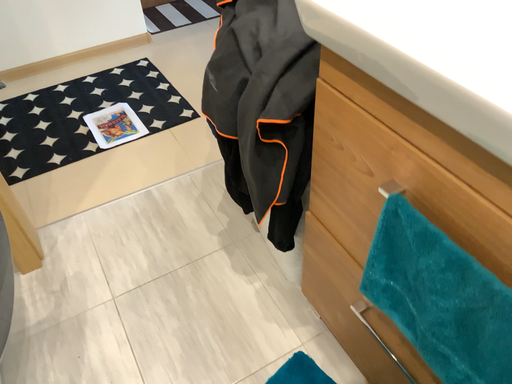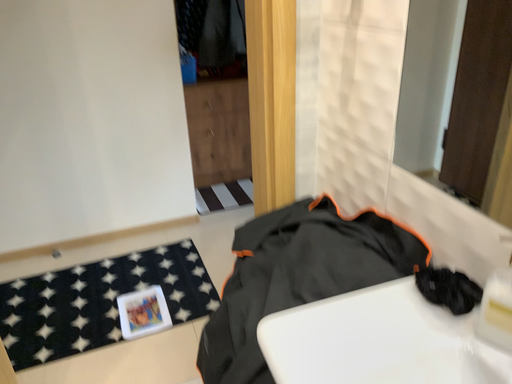
Question: Which way did the camera rotate in the video?

Choices:
 (A) rotated left
 (B) rotated right

Answer: (A)